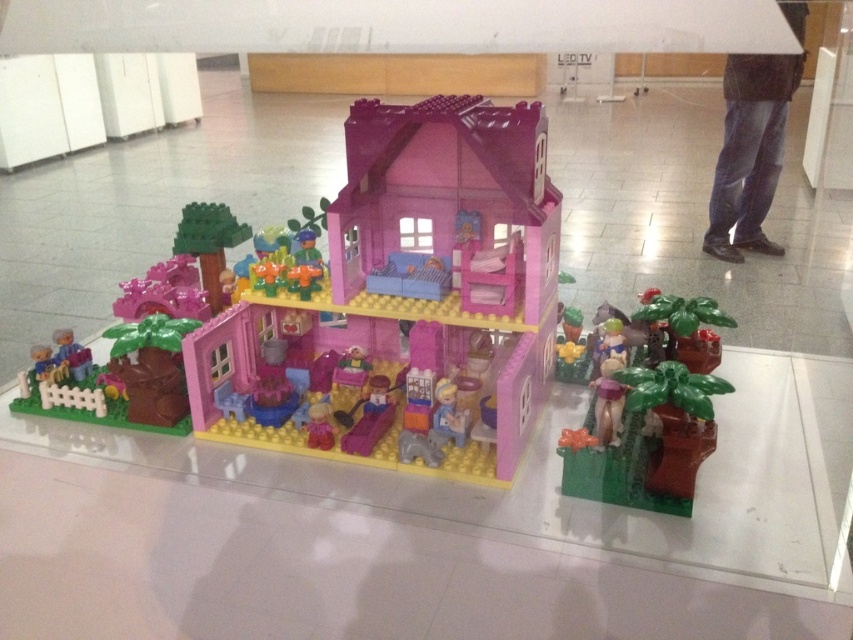
Question: Among these points, which one is nearest to the camera?

Choices:
 (A) (711, 412)
 (B) (376, 289)

Answer: (A)

Question: Is pink plastic house at center below green matte plant at lower right?

Choices:
 (A) no
 (B) yes

Answer: (A)

Question: Can you confirm if pink plastic house at center is thinner than green matte plant at lower right?

Choices:
 (A) yes
 (B) no

Answer: (B)

Question: Which point is farther from the camera taking this photo?

Choices:
 (A) (675, 467)
 (B) (366, 227)

Answer: (B)

Question: Can you confirm if pink plastic house at center is thinner than green matte plant at lower right?

Choices:
 (A) yes
 (B) no

Answer: (B)